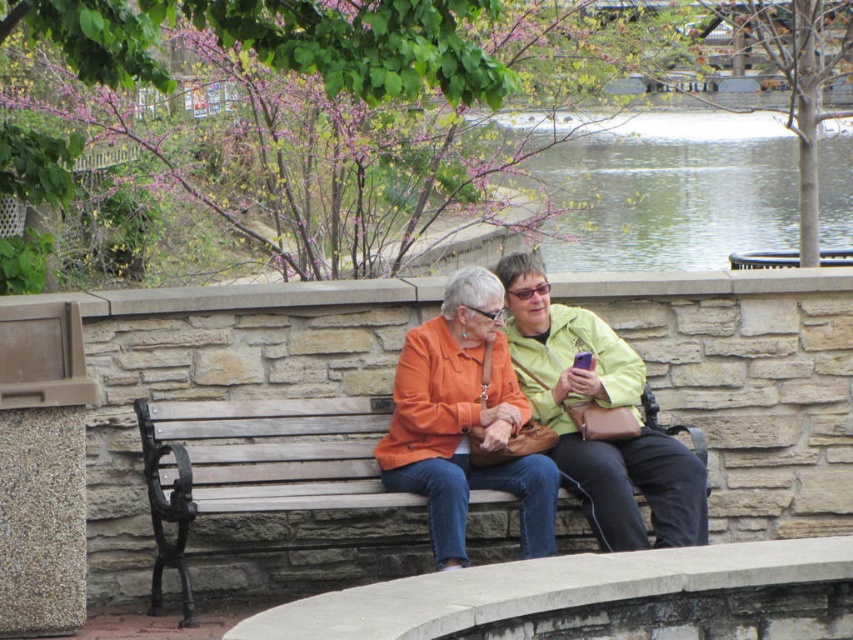
Question: Which object appears farthest from the camera in this image?

Choices:
 (A) matte orange jacket at center
 (B) wooden bench at center

Answer: (A)

Question: Which point appears closest to the camera in this image?

Choices:
 (A) (283, 424)
 (B) (618, 372)

Answer: (A)

Question: Does wooden bench at center appear over matte orange jacket at center?

Choices:
 (A) no
 (B) yes

Answer: (A)

Question: Is wooden bench at center thinner than matte orange jacket at center?

Choices:
 (A) yes
 (B) no

Answer: (B)

Question: Is wooden bench at center above matte orange jacket at center?

Choices:
 (A) yes
 (B) no

Answer: (B)

Question: Which point is closer to the camera?

Choices:
 (A) wooden bench at center
 (B) matte orange jacket at center

Answer: (A)